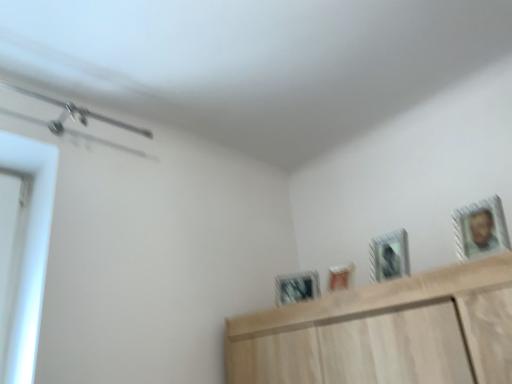
Question: From a real-world perspective, is metallic silver picture frame at upper right, which is counted as the first picture frame, starting from the right, physically located above or below matte white picture frame at center, which ranks as the second picture frame in left-to-right order?

Choices:
 (A) below
 (B) above

Answer: (B)

Question: Choose the correct answer: Is metallic silver picture frame at upper right, the 4th picture frame from the back, inside matte white picture frame at center, the third picture frame in the front-to-back sequence, or outside it?

Choices:
 (A) inside
 (B) outside

Answer: (B)

Question: Which object is the closest to the metallic silver picture frame at center, the first picture frame positioned from the left?

Choices:
 (A) matte white picture frame at center, which is counted as the 3th picture frame, starting from the right
 (B) metallic silver picture frame at upper right, the 4th picture frame from the back
 (C) metallic silver picture frame at upper center, which is counted as the 3th picture frame, starting from the back

Answer: (A)

Question: Based on their relative distances, which object is nearer to the matte white picture frame at center, marked as the 2th picture frame in a back-to-front arrangement?

Choices:
 (A) metallic silver picture frame at upper right, which is counted as the first picture frame, starting from the right
 (B) metallic silver picture frame at upper center, marked as the 2th picture frame in a right-to-left arrangement
 (C) metallic silver picture frame at center, positioned as the fourth picture frame in right-to-left order

Answer: (B)